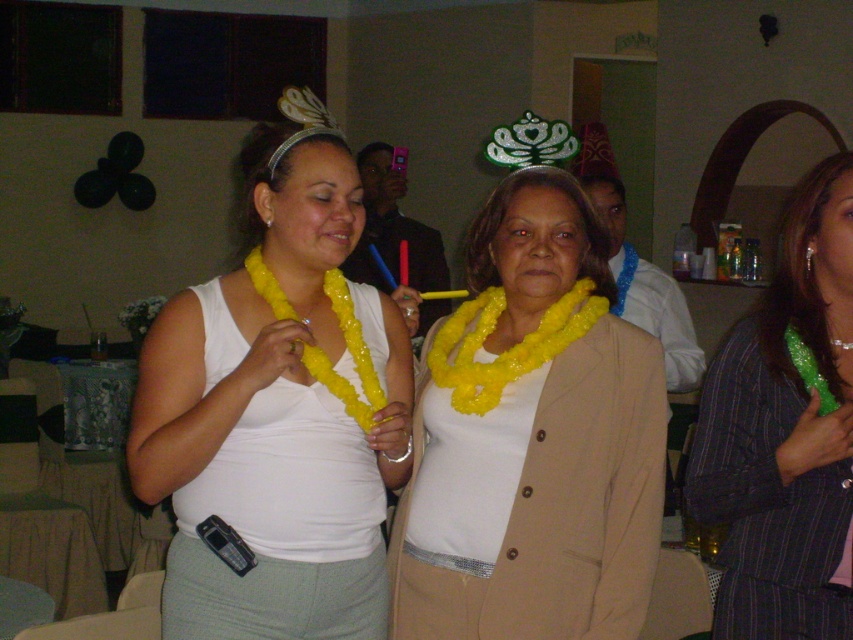
Is green glittery necklace at center below yellow beaded lei at center?

Yes, green glittery necklace at center is below yellow beaded lei at center.

Does point (824, 529) come farther from viewer compared to point (254, 289)?

No, (824, 529) is closer to viewer.

Looking at this image, who is more forward, (814, 376) or (258, 259)?

Point (814, 376) is in front.

Find the location of `green glittery necklace at center`. green glittery necklace at center is located at coordinates (785, 432).

Between matte yellow necklace at center and yellow beaded lei at center, which one appears on the right side from the viewer's perspective?

From the viewer's perspective, matte yellow necklace at center appears more on the right side.

Does point (448, 508) come closer to viewer compared to point (256, 268)?

Yes.

Who is more distant from viewer, (x=593, y=445) or (x=260, y=264)?

The point (x=260, y=264) is behind.

Locate an element on the screen. The height and width of the screenshot is (640, 853). matte yellow necklace at center is located at coordinates (532, 438).

Is matte yellow necklace at center wider than green glittery necklace at center?

Indeed, matte yellow necklace at center has a greater width compared to green glittery necklace at center.

Which is behind, point (508, 452) or point (827, 504)?

Positioned behind is point (508, 452).

What do you see at coordinates (532, 438) in the screenshot?
I see `matte yellow necklace at center` at bounding box center [532, 438].

This screenshot has width=853, height=640. Identify the location of matte yellow necklace at center. (532, 438).